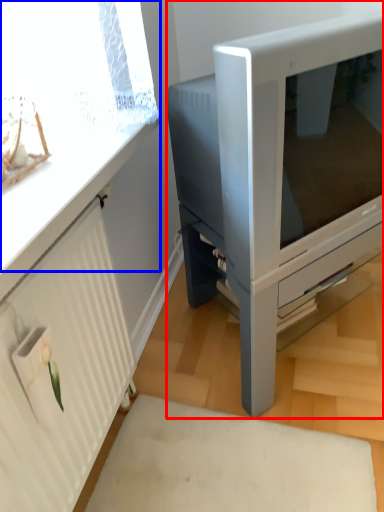
Question: Which of the following is the closest to the observer, furniture (highlighted by a red box) or window screen (highlighted by a blue box)?

Choices:
 (A) furniture
 (B) window screen

Answer: (B)